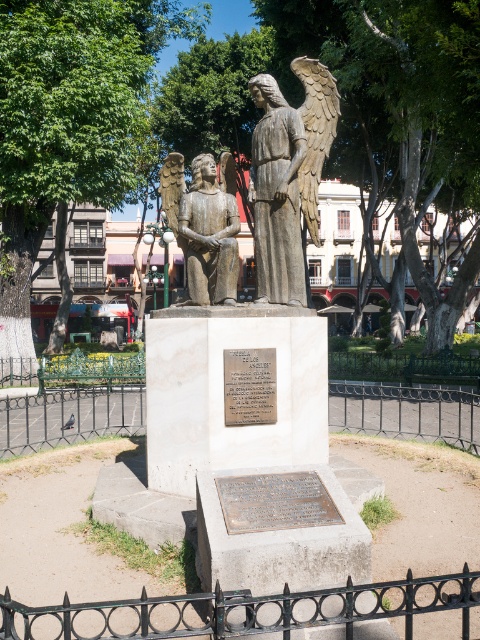
Question: Among these objects, which one is nearest to the camera?

Choices:
 (A) bronze plaque at center
 (B) bronze statue of an angel at center
 (C) black wrought iron fence at center

Answer: (A)

Question: Considering the real-world distances, which object is farthest from the black wrought iron fence at center?

Choices:
 (A) black wrought iron fence at lower center
 (B) bronze statue at center
 (C) bronze plaque at center
 (D) bronze statue of an angel at center

Answer: (B)

Question: Which point is farther from the camera taking this photo?

Choices:
 (A) (131, 380)
 (B) (302, 180)
 (C) (206, 600)
 (D) (242, 368)

Answer: (A)

Question: Does black wrought iron fence at center have a greater width compared to bronze plaque at center?

Choices:
 (A) yes
 (B) no

Answer: (A)

Question: Where is black wrought iron fence at center located in relation to bronze statue at center in the image?

Choices:
 (A) above
 (B) below

Answer: (B)

Question: Is bronze statue of an angel at center thinner than bronze plaque at center?

Choices:
 (A) no
 (B) yes

Answer: (A)